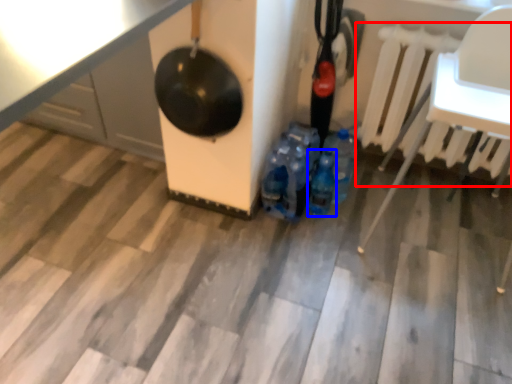
Question: Which object appears closest to the camera in this image, radiator (highlighted by a red box) or bottle (highlighted by a blue box)?

Choices:
 (A) radiator
 (B) bottle

Answer: (A)